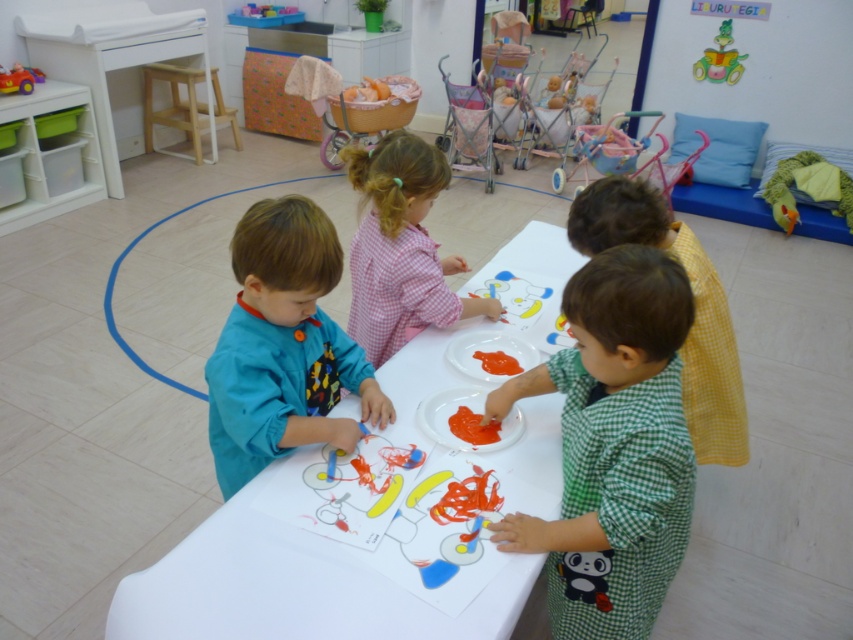
Question: Which of the following is the farthest from the observer?

Choices:
 (A) green checkered shirt at center
 (B) rubberized plastic toy car at upper left

Answer: (B)

Question: Considering the relative positions of green checkered shirt at center and pink checkered shirt at center in the image provided, where is green checkered shirt at center located with respect to pink checkered shirt at center?

Choices:
 (A) left
 (B) right

Answer: (B)

Question: Can you confirm if green checkered shirt at center is positioned to the right of white paper table at center?

Choices:
 (A) yes
 (B) no

Answer: (A)

Question: Does plastic yellow car at upper right appear on the right side of rubberized plastic toy car at upper left?

Choices:
 (A) no
 (B) yes

Answer: (B)

Question: Considering the real-world distances, which object is closest to the matte blue shirt at left?

Choices:
 (A) green checkered shirt at center
 (B) rubberized plastic toy car at upper left

Answer: (A)

Question: Which point is closer to the camera taking this photo?

Choices:
 (A) (412, 234)
 (B) (10, 68)
 (C) (212, 544)
 (D) (572, 301)

Answer: (D)